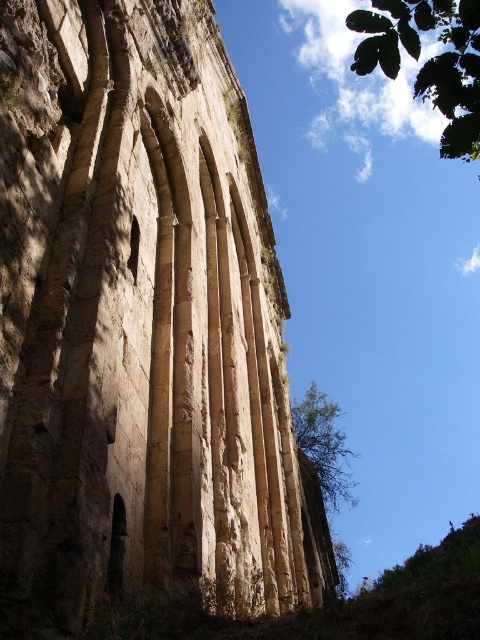
You are an architect examining the ancient stone structure. You notice two green leafy trees in the scene. Which tree has a greater width between the green leafy tree at upper right and the green leafy tree at center?

The green leafy tree at upper right has a greater width than the green leafy tree at center.

You are an architect examining the ancient stone structure. You notice the rustic stone arches at center and the green leafy tree at center. Which object appears smaller in the image?

The rustic stone arches at center has a smaller size compared to the green leafy tree at center, so the rustic stone arches at center appears smaller.

You are an architect analyzing the ancient stone structure. You notice a green leafy tree in the scene. Where is the green leafy tree at upper right located in terms of coordinates?

The green leafy tree at upper right is located at coordinates point [429,60].